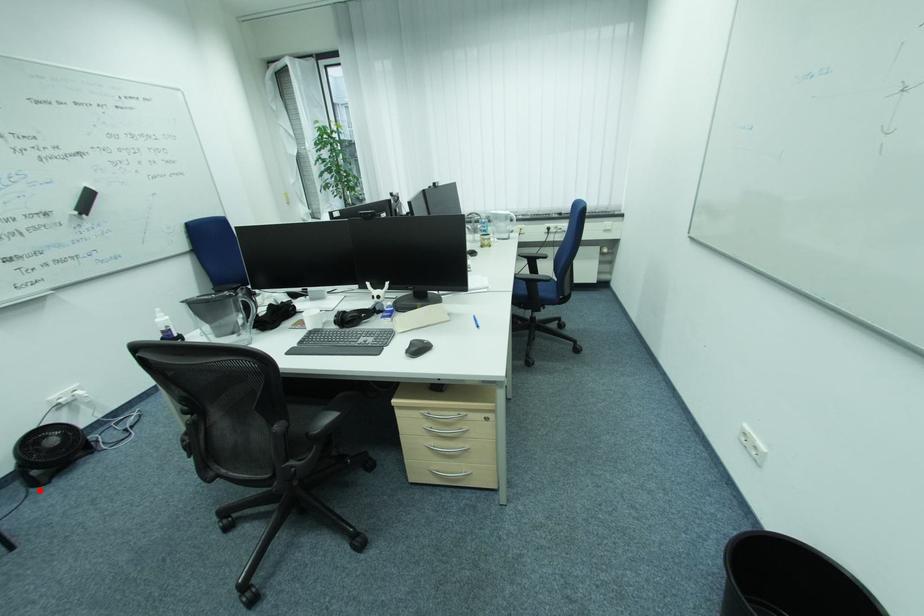
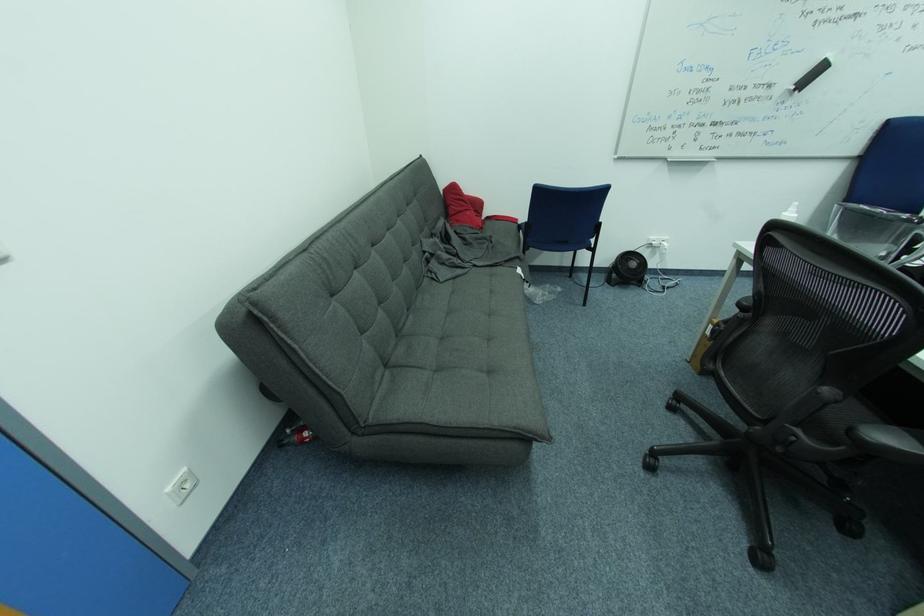
Question: I am providing you with two images of the same scene from different viewpoints. A red point is marked on the first image. Can you still see the location of the red point in image 2?

Choices:
 (A) Yes
 (B) No

Answer: (A)